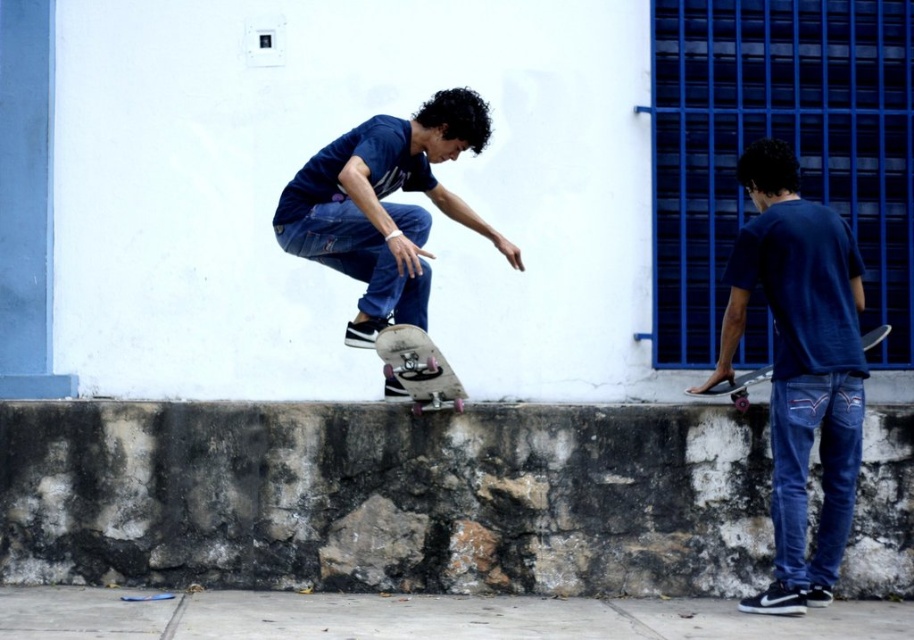
Question: Does matte blue shirt at center have a lesser width compared to matte black skateboard at right?

Choices:
 (A) no
 (B) yes

Answer: (A)

Question: Is blue denim jeans at lower right below white glossy skateboard at center?

Choices:
 (A) yes
 (B) no

Answer: (A)

Question: Where is blue denim jeans at lower right located in relation to white glossy skateboard at center in the image?

Choices:
 (A) above
 (B) below

Answer: (B)

Question: Considering the real-world distances, which object is farthest from the blue denim jeans at lower right?

Choices:
 (A) white glossy skateboard at center
 (B) matte black skateboard at right
 (C) matte blue shirt at center

Answer: (C)

Question: Which point appears farthest from the camera in this image?

Choices:
 (A) (407, 157)
 (B) (879, 332)
 (C) (417, 369)

Answer: (B)

Question: Which point is closer to the camera?

Choices:
 (A) (838, 564)
 (B) (343, 195)
 (C) (740, 384)
 (D) (421, 396)

Answer: (B)